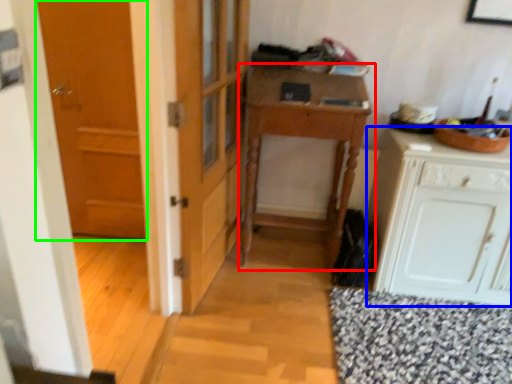
Question: Which is nearer to the table (highlighted by a red box)? cabinetry (highlighted by a blue box) or door (highlighted by a green box).

Choices:
 (A) cabinetry
 (B) door

Answer: (A)